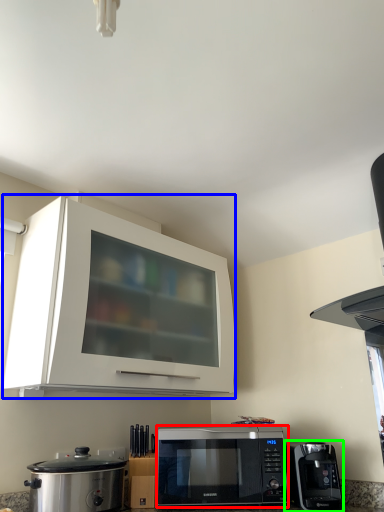
Question: Which object is positioned farthest from microwave oven (highlighted by a red box)? Select from cabinetry (highlighted by a blue box) and coffee maker (highlighted by a green box).

Choices:
 (A) cabinetry
 (B) coffee maker

Answer: (A)